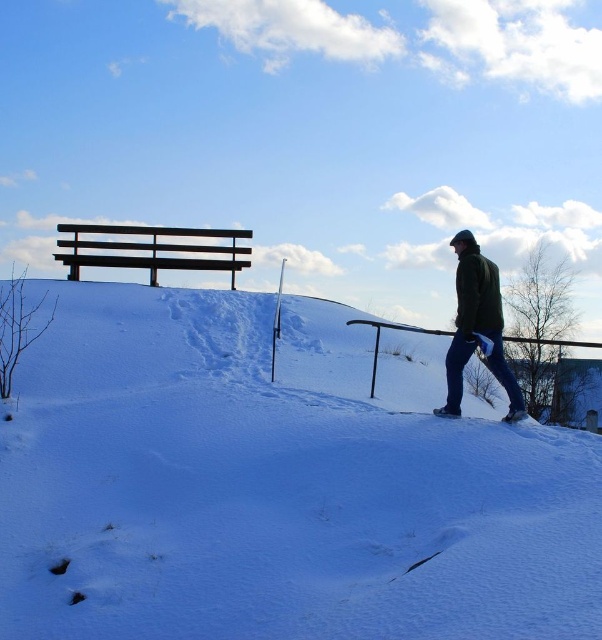
You are standing at the camera position and want to reach the point at coordinates (182, 467). If your walking speed is 1.2 meters per second, how many seconds will it take you to reach that point?

The distance to the point is 5.64 meters. At a speed of 1.2 meters per second, it would take 5.64 divided by 1.2, which equals approximately 4.7 seconds.

From the picture: You are standing at the bottom of the hill and see the white powdery snow at lower center and the dark green jacket at right. Which object is closer to you?

The white powdery snow at lower center is closer to you because it is positioned below the dark green jacket at right, indicating it is nearer in the visual hierarchy.

You are an observer standing at the edge of the snow in the winter scene. You see the white powdery snow at lower center and the dark green jacket at right. Which object is larger in size?

The dark green jacket at right is larger than the white powdery snow at lower center.